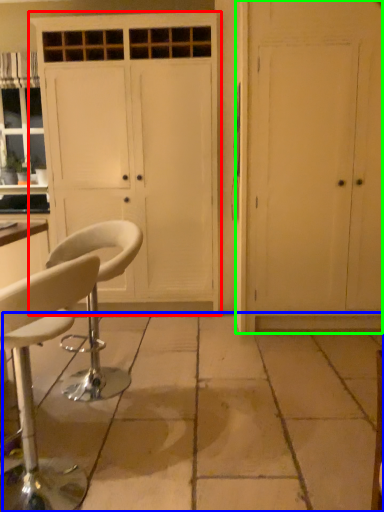
Question: Which object is the closest to the cabinetry (highlighted by a red box)? Choose among these: concrete (highlighted by a blue box) or door (highlighted by a green box).

Choices:
 (A) concrete
 (B) door

Answer: (B)